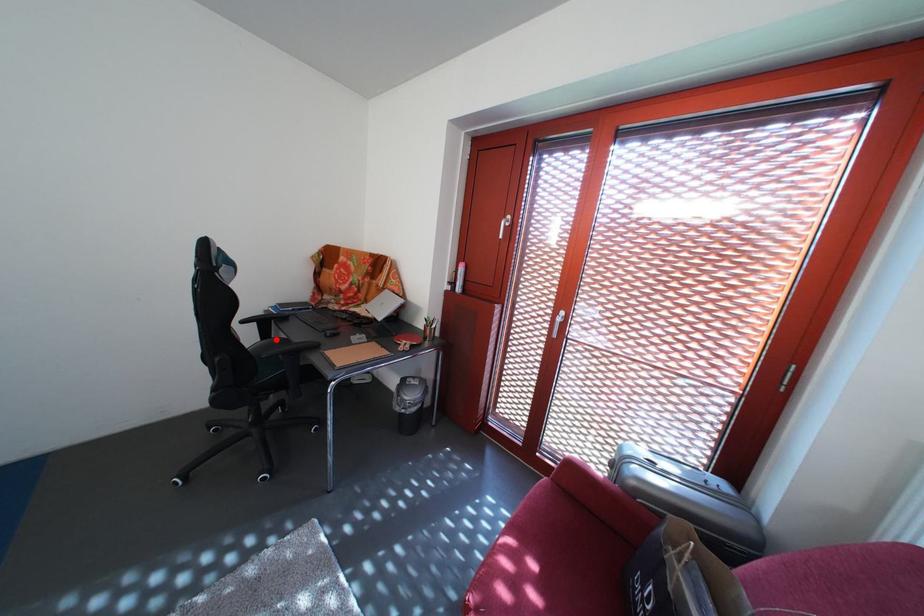
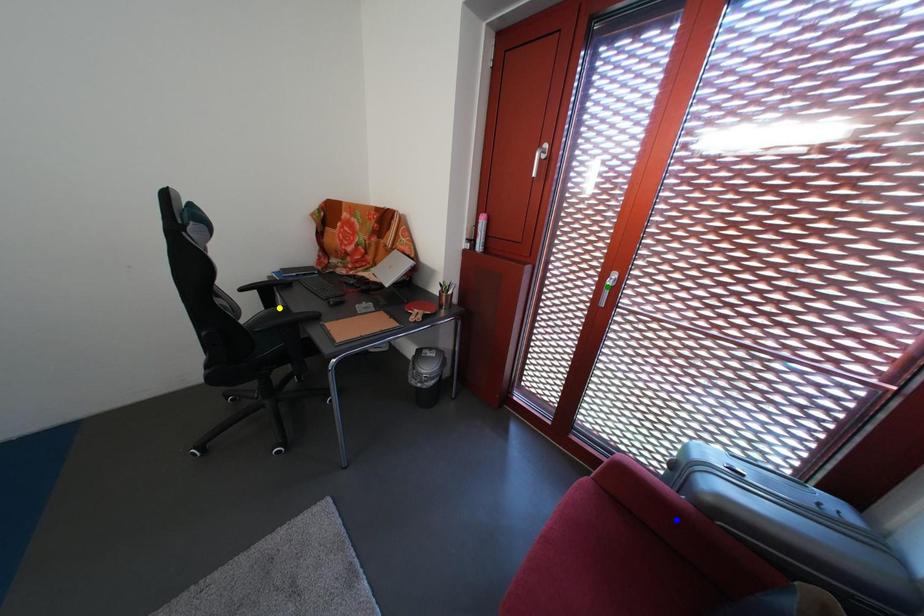
Question: I am providing you with two images of the same scene from different viewpoints. A red point is marked on the first image. You are given multiple points on the second image. Which mark in image 2 goes with the point in image 1?

Choices:
 (A) yellow point
 (B) blue point
 (C) green point

Answer: (A)